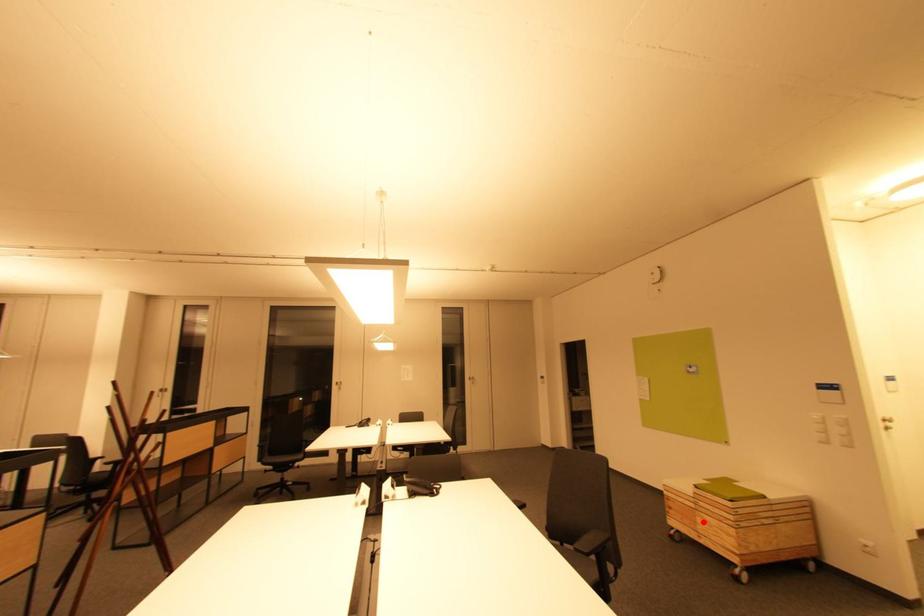
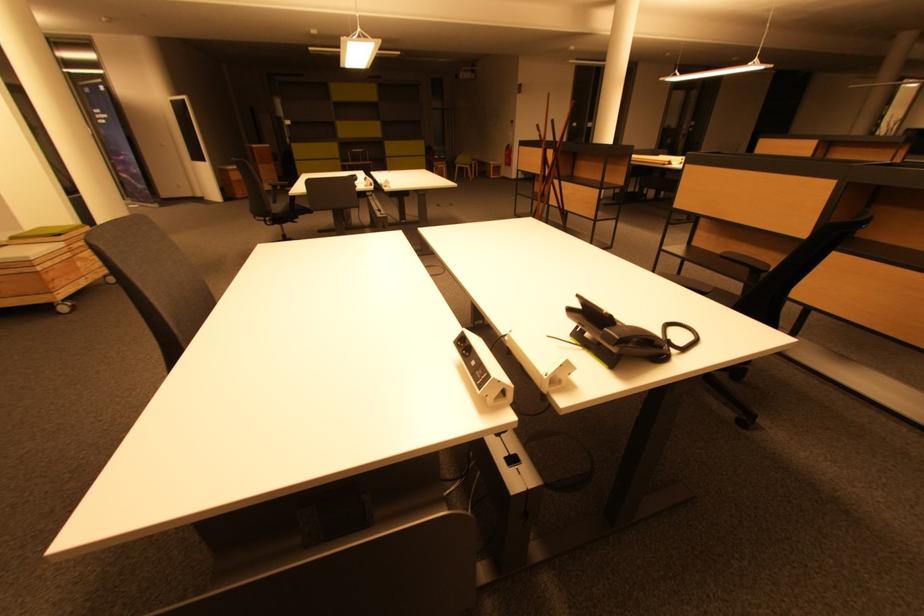
Where in the second image is the point corresponding to the highlighted location from the first image?

(83, 265)